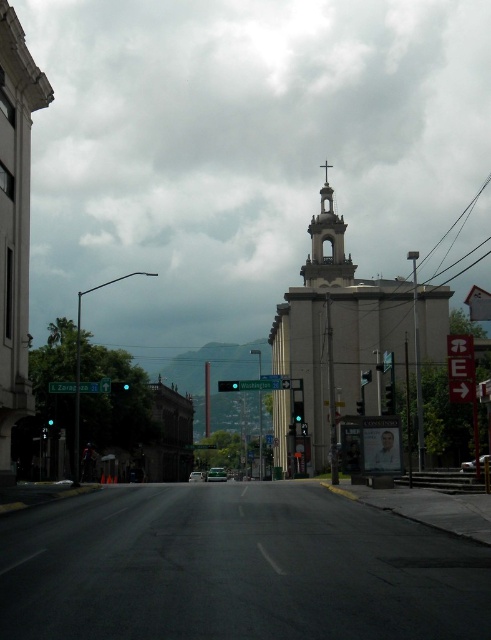
You are a delivery driver who needs to determine which structure is taller to plan your route for a low clearance truck. Which one is taller between the smooth concrete church at center and the smooth stone bell tower at center?

The smooth concrete church at center is taller than the smooth stone bell tower at center, so the truck should avoid the smooth concrete church at center to prevent damage.

You are a city planner evaluating the width of two churches in the image. The smooth concrete church at center and the white stone church at left. Which one has a greater width?

The smooth concrete church at center has a greater width than the white stone church at left according to the description.